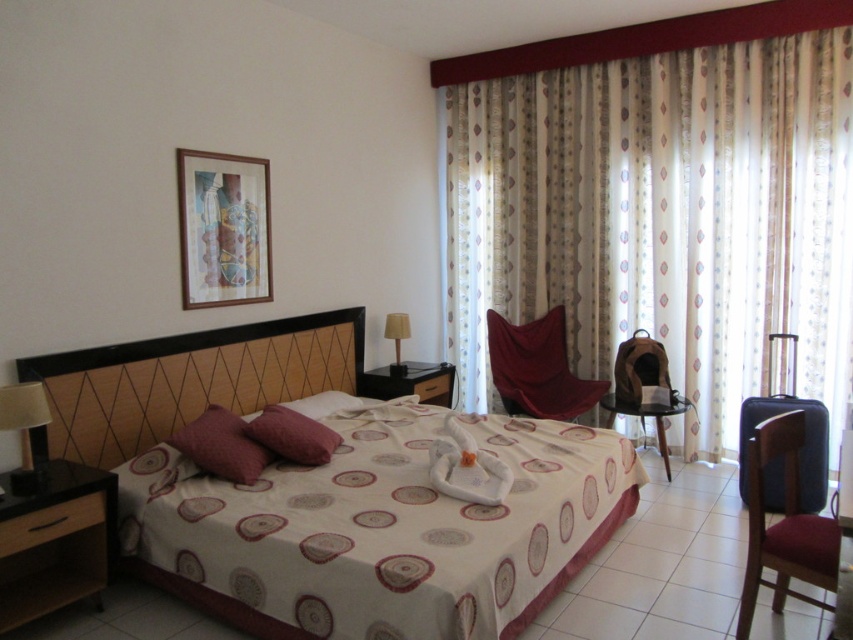
Question: Can you confirm if velvet plum pillow at center is positioned to the left of black plastic stool at center?

Choices:
 (A) no
 (B) yes

Answer: (B)

Question: Which object is the closest to the velvet red armchair at center?

Choices:
 (A) velvet plum pillow at center
 (B) velvet maroon chair at right
 (C) black plastic stool at center
 (D) beige fabric lampshade at center

Answer: (C)

Question: Which point is closer to the camera?

Choices:
 (A) (122, 397)
 (B) (68, 458)
 (C) (38, 417)
 (D) (793, 508)

Answer: (C)

Question: In this image, where is wooden at left located relative to matte black lamp at left?

Choices:
 (A) left
 (B) right

Answer: (B)

Question: Considering the relative positions of patterned fabric curtain at center and velvet-like red pillow at center-left in the image provided, where is patterned fabric curtain at center located with respect to velvet-like red pillow at center-left?

Choices:
 (A) right
 (B) left

Answer: (A)

Question: Which point is farther from the camera taking this photo?

Choices:
 (A) (399, 342)
 (B) (717, 269)

Answer: (A)